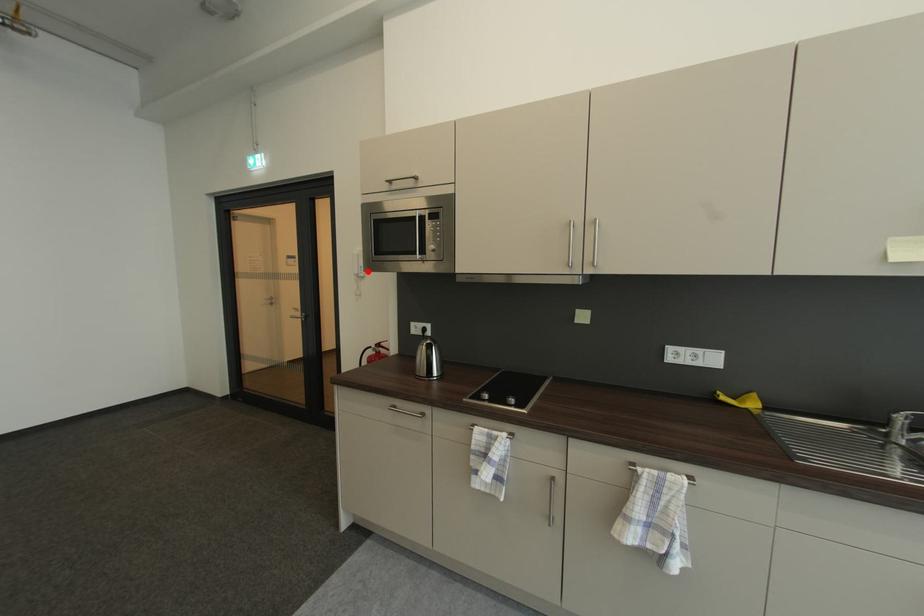
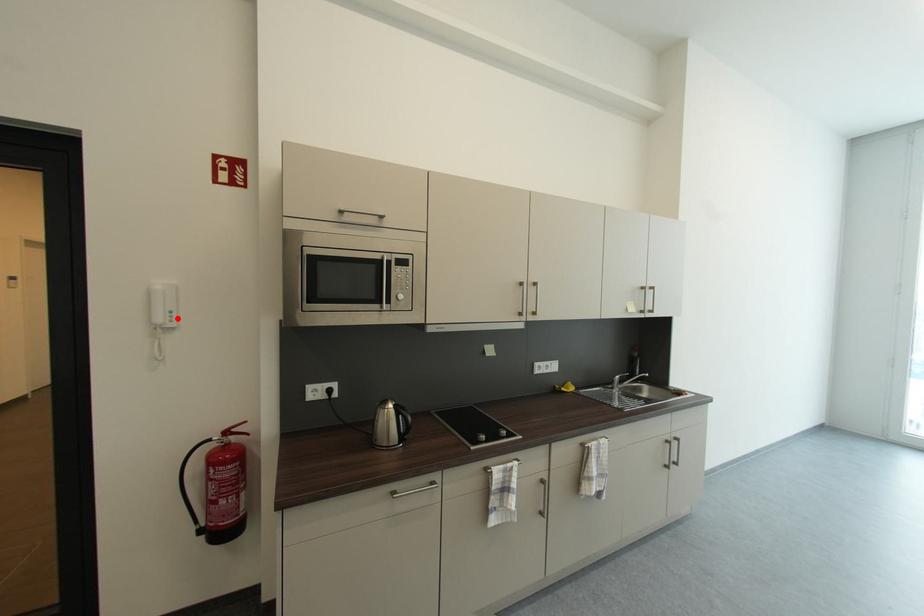
I am providing you with two images of the same scene from different viewpoints. A red point is marked on the first image and another point is marked on the second image. Is the marked point in image1 the same physical position as the marked point in image2?

Yes